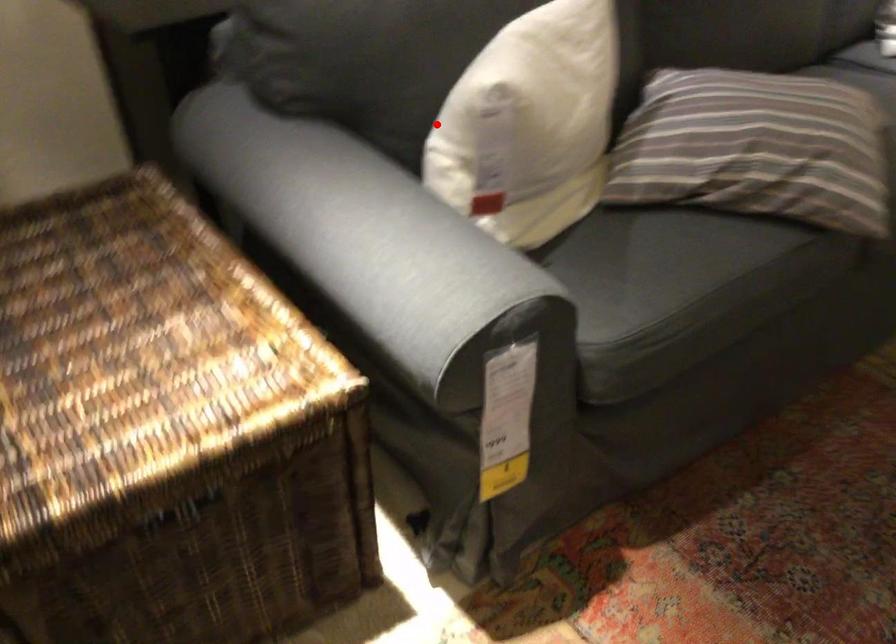
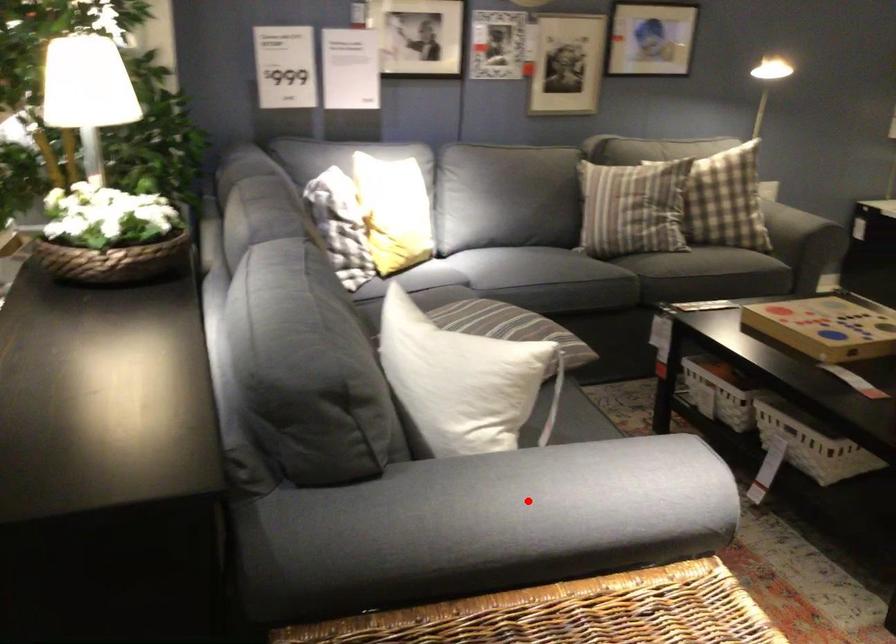
I am providing you with two images of the same scene from different viewpoints. A red point is marked on the first image and another point is marked on the second image. Is the red point in image1 aligned with the point shown in image2?

No